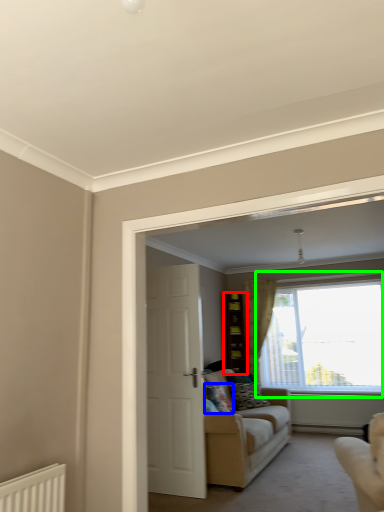
Question: Which is nearer to the cabinetry (highlighted by a red box)? pillow (highlighted by a blue box) or window (highlighted by a green box).

Choices:
 (A) pillow
 (B) window

Answer: (B)